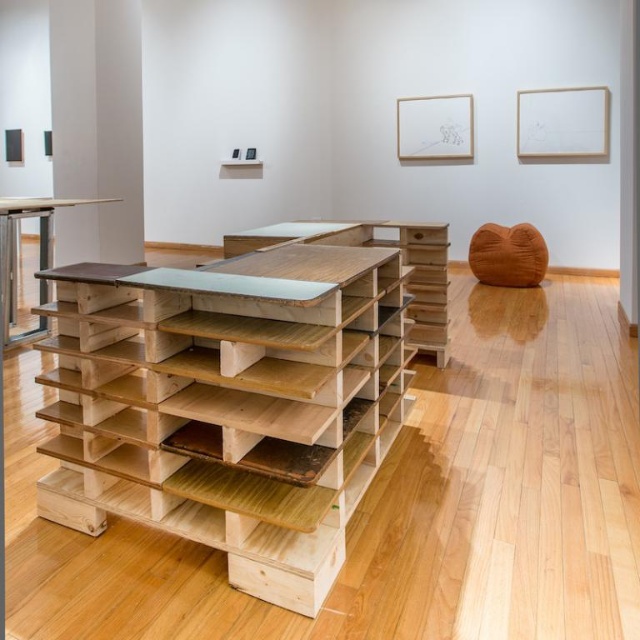
Question: Based on their relative distances, which object is nearer to the clear glass table at center?

Choices:
 (A) natural wood table at left
 (B) natural wood bookshelf at center

Answer: (B)

Question: Can you confirm if natural wood bookshelf at center is positioned to the left of natural wood table at left?

Choices:
 (A) no
 (B) yes

Answer: (A)

Question: Can you confirm if natural wood table at left is positioned below clear glass table at center?

Choices:
 (A) no
 (B) yes

Answer: (B)

Question: Which object appears farthest from the camera in this image?

Choices:
 (A) natural wood table at left
 (B) clear glass table at center
 (C) natural wood bookshelf at center

Answer: (B)

Question: Is natural wood bookshelf at center to the left of clear glass table at center from the viewer's perspective?

Choices:
 (A) yes
 (B) no

Answer: (A)

Question: Which point is farther from the camera taking this photo?

Choices:
 (A) (353, 236)
 (B) (64, 204)

Answer: (B)